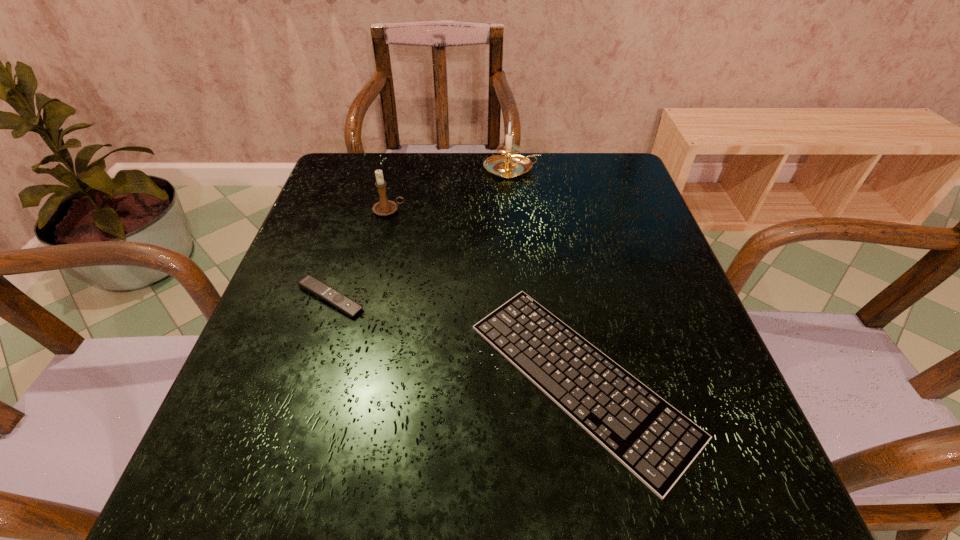
This screenshot has width=960, height=540. In the image, there is a desktop. In order to click on blank space at the far left corner in this screenshot , I will do `click(359, 191)`.

You are a GUI agent. You are given a task and a screenshot of the screen. Output one action in this format:
    pyautogui.click(x=<x>, y=<y>)
    Task: Click on the vacant region at the near left corner of the desktop
    
    Given the screenshot: What is the action you would take?
    pyautogui.click(x=288, y=482)

This screenshot has width=960, height=540. Find the location of `free location at the near right corner of the desktop`. free location at the near right corner of the desktop is located at coordinates (667, 514).

Locate an element on the screen. Image resolution: width=960 pixels, height=540 pixels. free space between the remote control and the computer keyboard is located at coordinates (455, 339).

Identify the location of free point between the tallest object and the nearer candle holder. (450, 190).

This screenshot has height=540, width=960. In order to click on free spot between the farthest object and the left candle holder in this screenshot , I will do pyautogui.click(x=450, y=190).

The width and height of the screenshot is (960, 540). I want to click on blank region between the remote control and the taller candle holder, so click(x=421, y=233).

Locate an element on the screen. This screenshot has width=960, height=540. vacant area between the farthest object and the remote control is located at coordinates (421, 233).

This screenshot has height=540, width=960. I want to click on free point between the remote control and the computer keyboard, so click(x=455, y=339).

Where is `free point between the computer keyboard and the remote control`? This screenshot has height=540, width=960. free point between the computer keyboard and the remote control is located at coordinates (455, 339).